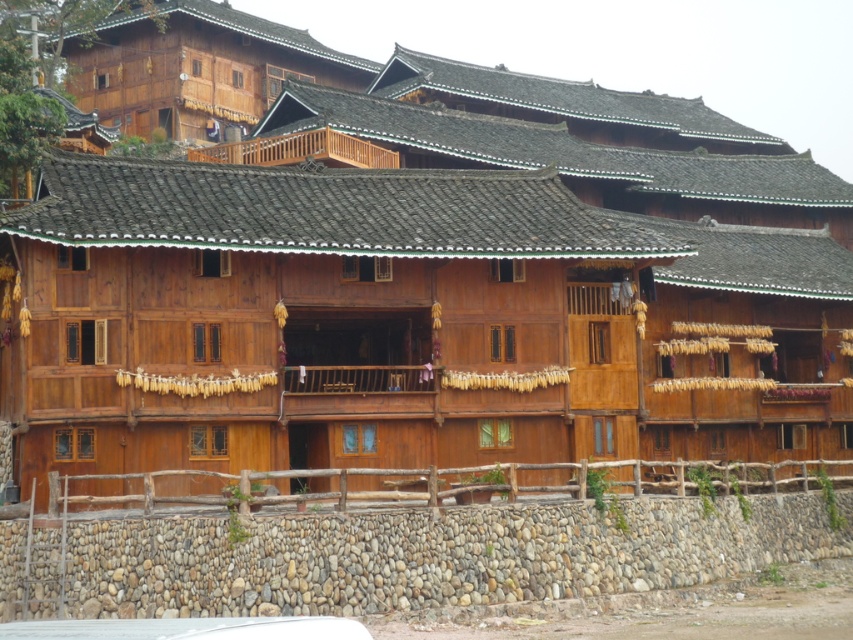
Between white matte car at lower center and natural wood balcony at upper center, which one is positioned higher?

natural wood balcony at upper center

Based on the photo, does white matte car at lower center have a lesser width compared to natural wood balcony at upper center?

Yes, white matte car at lower center is thinner than natural wood balcony at upper center.

Does point (294, 620) lie in front of point (325, 134)?

Yes, point (294, 620) is in front of point (325, 134).

You are a GUI agent. You are given a task and a screenshot of the screen. Output one action in this format:
    pyautogui.click(x=<x>, y=<y>)
    Task: Click on the white matte car at lower center
    The height and width of the screenshot is (640, 853).
    Given the screenshot: What is the action you would take?
    pyautogui.click(x=190, y=628)